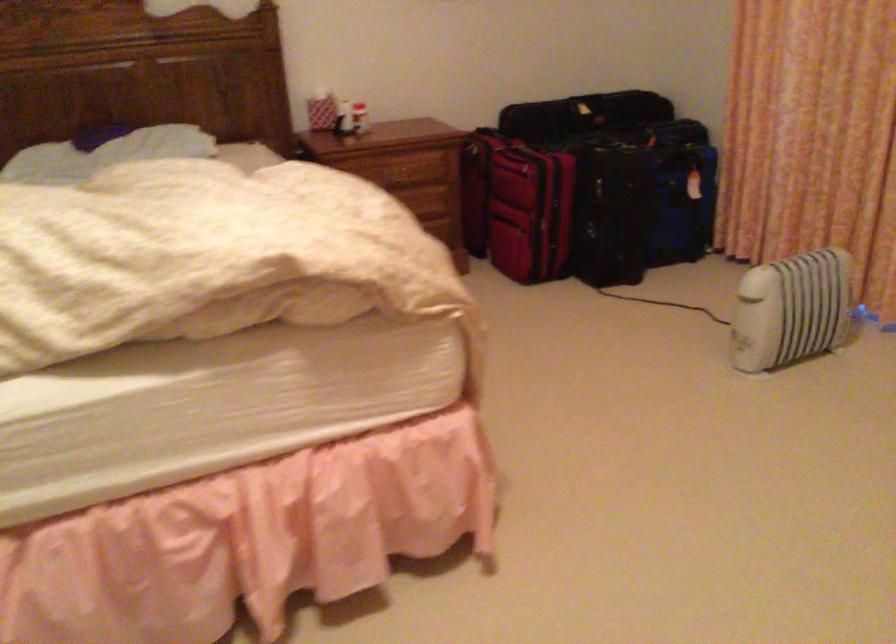
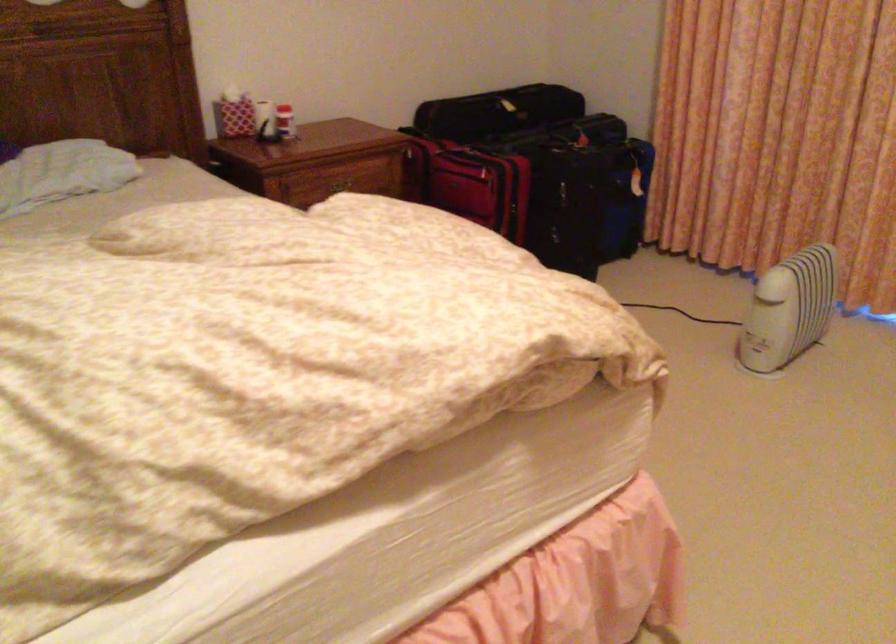
The point at (357, 109) is marked in the first image. Where is the corresponding point in the second image?

(285, 122)